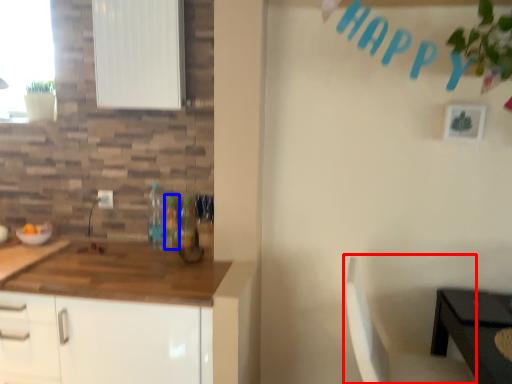
Question: Which of the following is the closest to the observer, chair (highlighted by a red box) or bottle (highlighted by a blue box)?

Choices:
 (A) chair
 (B) bottle

Answer: (A)